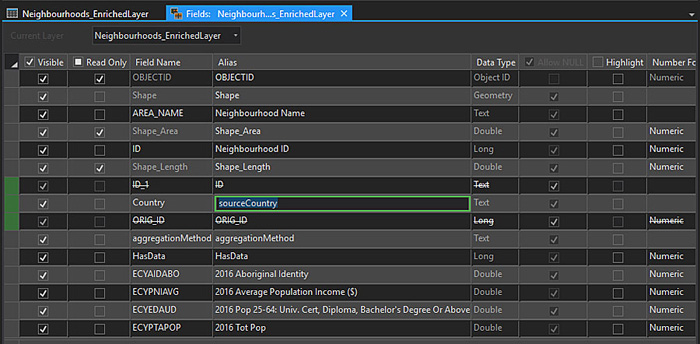
The width and height of the screenshot is (700, 344). I want to click on column, so click(x=57, y=62), click(x=94, y=63), click(x=172, y=63), click(x=266, y=62), click(x=504, y=58), click(x=547, y=60), click(x=624, y=62), click(x=673, y=63).